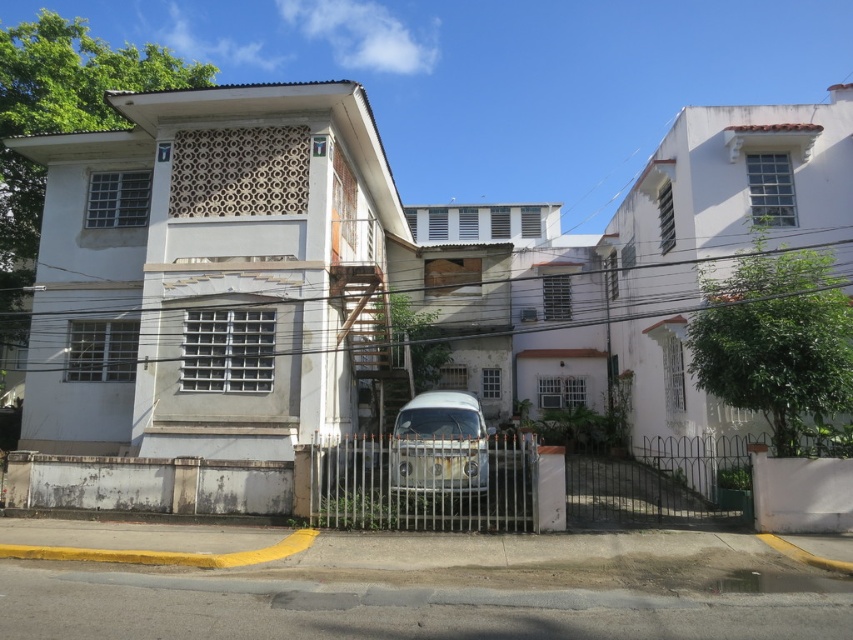
In the scene shown: Who is positioned more to the right, metallic gate at center or white matte van at center?

metallic gate at center is more to the right.

Which is behind, point (480, 524) or point (415, 428)?

Positioned behind is point (415, 428).

The width and height of the screenshot is (853, 640). I want to click on metallic gate at center, so click(428, 483).

Find the location of a particular element. metallic gate at center is located at coordinates (428, 483).